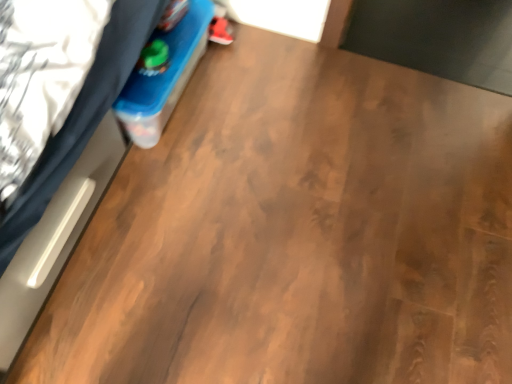
Question: From the image's perspective, is white matte bed at left over matte red sneaker at upper center?

Choices:
 (A) no
 (B) yes

Answer: (A)

Question: Could you tell me if white matte bed at left is facing matte red sneaker at upper center?

Choices:
 (A) yes
 (B) no

Answer: (B)

Question: Is white matte bed at left next to matte red sneaker at upper center and touching it?

Choices:
 (A) no
 (B) yes

Answer: (A)

Question: Does white matte bed at left have a lesser width compared to matte red sneaker at upper center?

Choices:
 (A) no
 (B) yes

Answer: (A)

Question: Is there a large distance between white matte bed at left and matte red sneaker at upper center?

Choices:
 (A) yes
 (B) no

Answer: (B)

Question: Is white matte bed at left smaller than matte red sneaker at upper center?

Choices:
 (A) no
 (B) yes

Answer: (A)

Question: Can you confirm if matte red sneaker at upper center is positioned to the right of white matte bed at left?

Choices:
 (A) yes
 (B) no

Answer: (A)

Question: From the image's perspective, does matte red sneaker at upper center appear lower than white matte bed at left?

Choices:
 (A) no
 (B) yes

Answer: (A)

Question: Is matte red sneaker at upper center aimed at white matte bed at left?

Choices:
 (A) yes
 (B) no

Answer: (A)

Question: From a real-world perspective, is matte red sneaker at upper center located higher than white matte bed at left?

Choices:
 (A) no
 (B) yes

Answer: (A)

Question: Are matte red sneaker at upper center and white matte bed at left making contact?

Choices:
 (A) yes
 (B) no

Answer: (B)

Question: Is matte red sneaker at upper center surrounding white matte bed at left?

Choices:
 (A) no
 (B) yes

Answer: (A)

Question: Would you say matte red sneaker at upper center is to the left or to the right of white matte bed at left in the picture?

Choices:
 (A) right
 (B) left

Answer: (A)